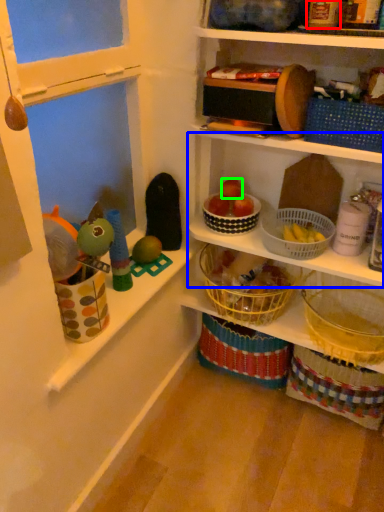
Question: Based on their relative distances, which object is nearer to toy (highlighted by a red box)? Choose from shelf (highlighted by a blue box) and apple (highlighted by a green box).

Choices:
 (A) shelf
 (B) apple

Answer: (A)